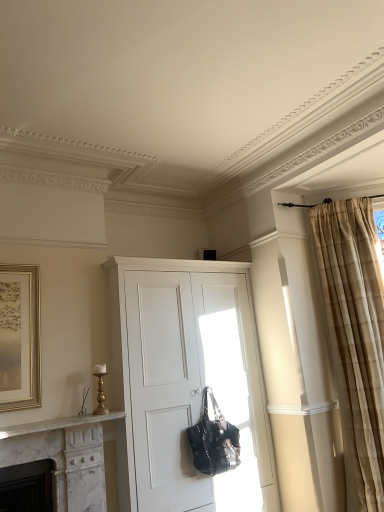
The image size is (384, 512). I want to click on black leather handbag at center, so click(214, 440).

Locate an element on the screen. The image size is (384, 512). white matte cabinet at center is located at coordinates (188, 381).

Locate an element on the screen. This screenshot has width=384, height=512. cabinetry in front of the beige textured curtain at right is located at coordinates (188, 381).

From the image's perspective, would you say white matte cabinet at center is shown under beige textured curtain at right?

Yes.

In the scene shown: Is white matte cabinet at center directly adjacent to beige textured curtain at right?

There is a gap between white matte cabinet at center and beige textured curtain at right.

How distant is white matte cabinet at center from beige textured curtain at right?

white matte cabinet at center is 1.01 meters from beige textured curtain at right.

Considering the relative positions of beige textured curtain at right and black leather handbag at center in the image provided, is beige textured curtain at right to the left of black leather handbag at center from the viewer's perspective?

In fact, beige textured curtain at right is to the right of black leather handbag at center.

Considering the sizes of beige textured curtain at right and black leather handbag at center in the image, is beige textured curtain at right bigger or smaller than black leather handbag at center?

In the image, beige textured curtain at right appears to be larger than black leather handbag at center.

Does beige textured curtain at right have a greater height compared to black leather handbag at center?

Indeed, beige textured curtain at right has a greater height compared to black leather handbag at center.

Is black leather handbag at center located outside beige textured curtain at right?

Yes, black leather handbag at center is outside of beige textured curtain at right.

Who is shorter, black leather handbag at center or beige textured curtain at right?

black leather handbag at center.

Is black leather handbag at center next to beige textured curtain at right?

black leather handbag at center is not next to beige textured curtain at right, and they're not touching.

Between black leather handbag at center and white matte cabinet at center, which one has more height?

Standing taller between the two is white matte cabinet at center.

Would you say black leather handbag at center is inside or outside white matte cabinet at center?

black leather handbag at center can be found inside white matte cabinet at center.

From the image's perspective, is black leather handbag at center above or below white matte cabinet at center?

Based on their image positions, black leather handbag at center is located beneath white matte cabinet at center.

From a real-world perspective, is black leather handbag at center physically above white matte cabinet at center?

No.

Which of these two, white matte cabinet at center or black leather handbag at center, is smaller?

black leather handbag at center is smaller.

Who is shorter, white matte cabinet at center or black leather handbag at center?

With less height is black leather handbag at center.

Which object is closer to the camera taking this photo, white matte cabinet at center or black leather handbag at center?

white matte cabinet at center is closer to the camera.

From the image's perspective, relative to black leather handbag at center, is white matte cabinet at center above or below?

white matte cabinet at center is situated higher than black leather handbag at center in the image.

Is beige textured curtain at right with white matte cabinet at center?

No, beige textured curtain at right is not making contact with white matte cabinet at center.

Is beige textured curtain at right oriented towards white matte cabinet at center?

No, beige textured curtain at right is not oriented towards white matte cabinet at center.

Considering the relative positions of beige textured curtain at right and white matte cabinet at center in the image provided, is beige textured curtain at right behind white matte cabinet at center?

Yes, it is.

How many degrees apart are the facing directions of beige textured curtain at right and white matte cabinet at center?

36.5 degrees.

This screenshot has width=384, height=512. What are the coordinates of `cabinetry that appears in front of the beige textured curtain at right` in the screenshot? It's located at (188, 381).

You are a GUI agent. You are given a task and a screenshot of the screen. Output one action in this format:
    pyautogui.click(x=<x>, y=<y>)
    Task: Click on the curtain on the right side of black leather handbag at center
    Image resolution: width=384 pixels, height=512 pixels.
    Given the screenshot: What is the action you would take?
    pyautogui.click(x=355, y=339)

When comparing their distances from beige textured curtain at right, does white matte cabinet at center or black leather handbag at center seem further?

black leather handbag at center lies further to beige textured curtain at right than the other object.

When comparing their distances from beige textured curtain at right, does black leather handbag at center or white matte cabinet at center seem further?

black leather handbag at center lies further to beige textured curtain at right than the other object.

Considering their positions, is black leather handbag at center positioned closer to white matte cabinet at center than beige textured curtain at right?

black leather handbag at center.

Considering their positions, is white matte cabinet at center positioned further to black leather handbag at center than beige textured curtain at right?

The object further to black leather handbag at center is beige textured curtain at right.

Considering their positions, is beige textured curtain at right positioned further to black leather handbag at center than white matte cabinet at center?

The object further to black leather handbag at center is beige textured curtain at right.

Looking at the image, which one is located further to white matte cabinet at center, beige textured curtain at right or black leather handbag at center?

Based on the image, beige textured curtain at right appears to be further to white matte cabinet at center.

Where is `handbag between white matte cabinet at center and beige textured curtain at right from left to right`? handbag between white matte cabinet at center and beige textured curtain at right from left to right is located at coordinates (214, 440).